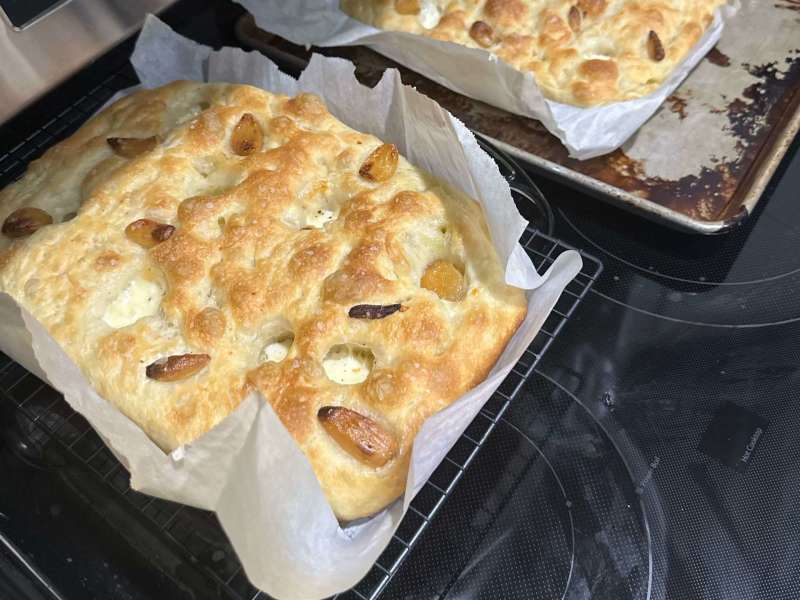
The height and width of the screenshot is (600, 800). I want to click on cooking ring markings on electric hob, so click(701, 282), click(698, 323), click(617, 451), click(556, 481).